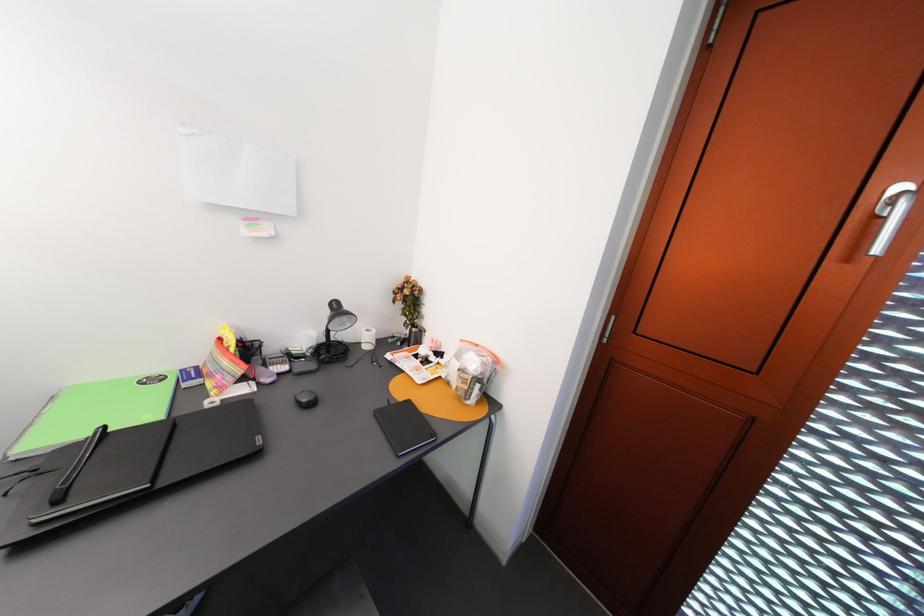
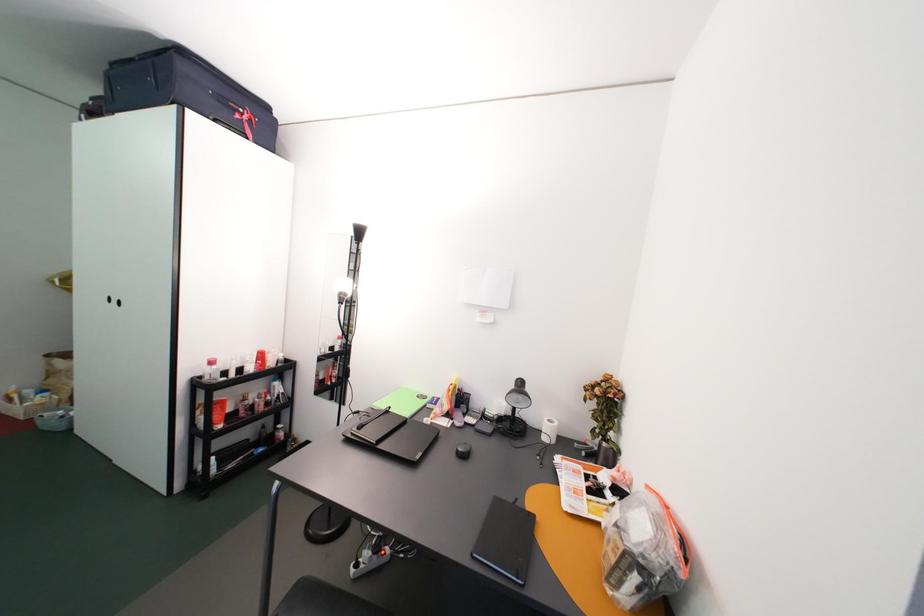
Question: How did the camera likely rotate?

Choices:
 (A) Left
 (B) Right
 (C) Up
 (D) Down

Answer: (A)